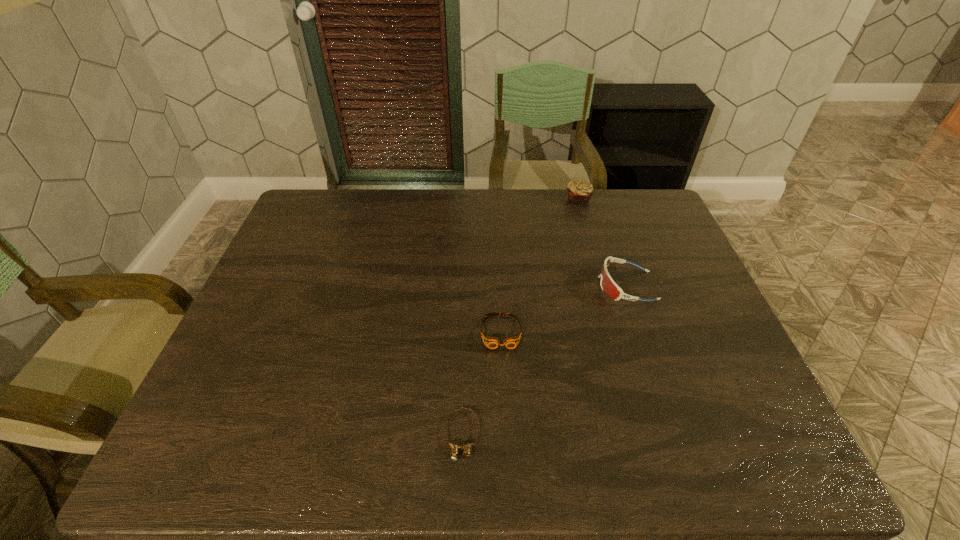
The width and height of the screenshot is (960, 540). I want to click on vacant point at the far right corner, so click(x=656, y=230).

Find the location of a particular element. The width and height of the screenshot is (960, 540). free point between the nearest object and the farthest object is located at coordinates (520, 318).

At what (x,y) coordinates should I click in order to perform the action: click on vacant space that's between the rightmost goggles and the second nearest goggles. Please return your answer as a coordinate pair (x, y). The width and height of the screenshot is (960, 540). Looking at the image, I should click on (564, 309).

Find the location of `vacant point located between the second goggles from right to left and the muffin`. vacant point located between the second goggles from right to left and the muffin is located at coordinates (540, 265).

Locate an element on the screen. The height and width of the screenshot is (540, 960). vacant space that's between the second shortest goggles and the rightmost goggles is located at coordinates (564, 309).

You are a GUI agent. You are given a task and a screenshot of the screen. Output one action in this format:
    pyautogui.click(x=<x>, y=<y>)
    Task: Click on the free space between the second object from left to right and the farthest object
    
    Given the screenshot: What is the action you would take?
    pyautogui.click(x=540, y=265)

This screenshot has width=960, height=540. Identify the location of empty space that is in between the rightmost goggles and the leftmost goggles. (544, 361).

You are a GUI agent. You are given a task and a screenshot of the screen. Output one action in this format:
    pyautogui.click(x=<x>, y=<y>)
    Task: Click on the free space between the second goggles from left to right and the farthest goggles
    This screenshot has height=540, width=960.
    Given the screenshot: What is the action you would take?
    pyautogui.click(x=564, y=309)

What are the coordinates of `free spot between the third tallest object and the muffin` in the screenshot? It's located at (540, 265).

Find the location of a particular element. free space that is in between the tallest goggles and the leftmost object is located at coordinates (544, 361).